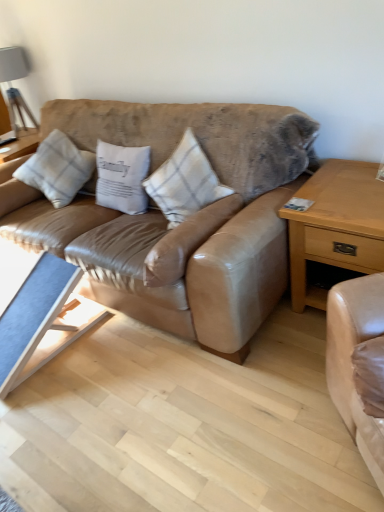
The height and width of the screenshot is (512, 384). I want to click on vacant space in between light brown wood nightstand at right and leather couch at center, so click(292, 348).